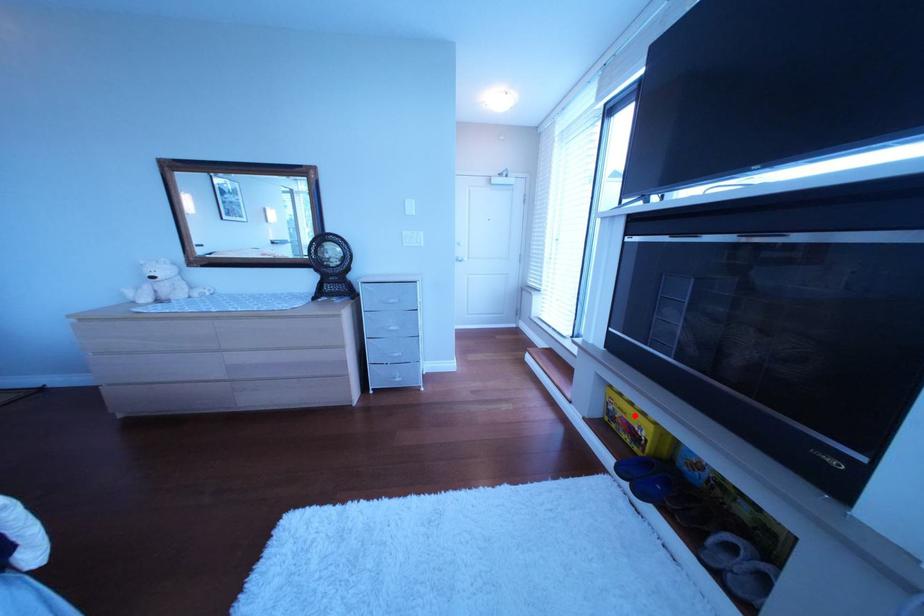
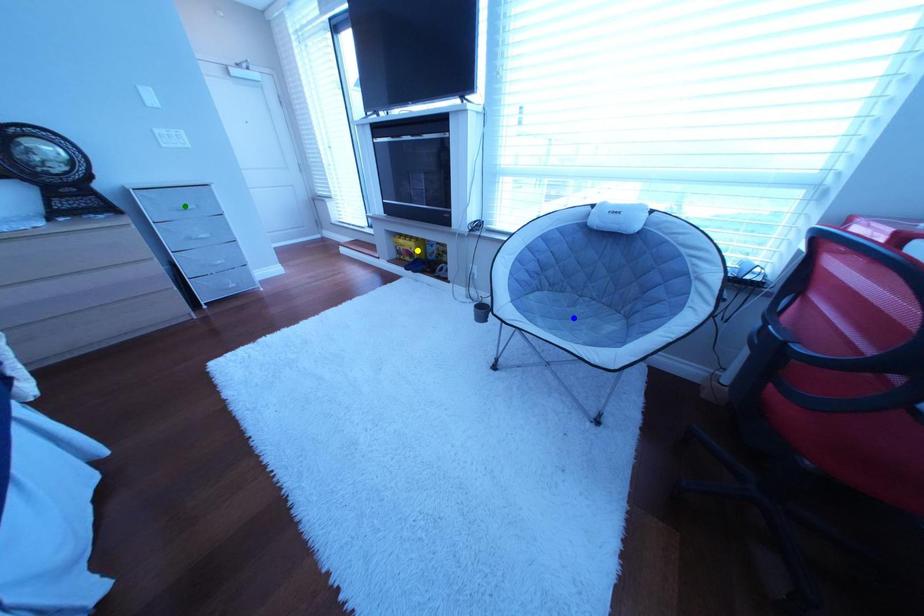
Question: I am providing you with two images of the same scene from different viewpoints. A red point is marked on the first image. You are given multiple points on the second image. Which point in image 2 is actually the same real-world point as the red point in image 1?

Choices:
 (A) blue point
 (B) green point
 (C) yellow point

Answer: (C)